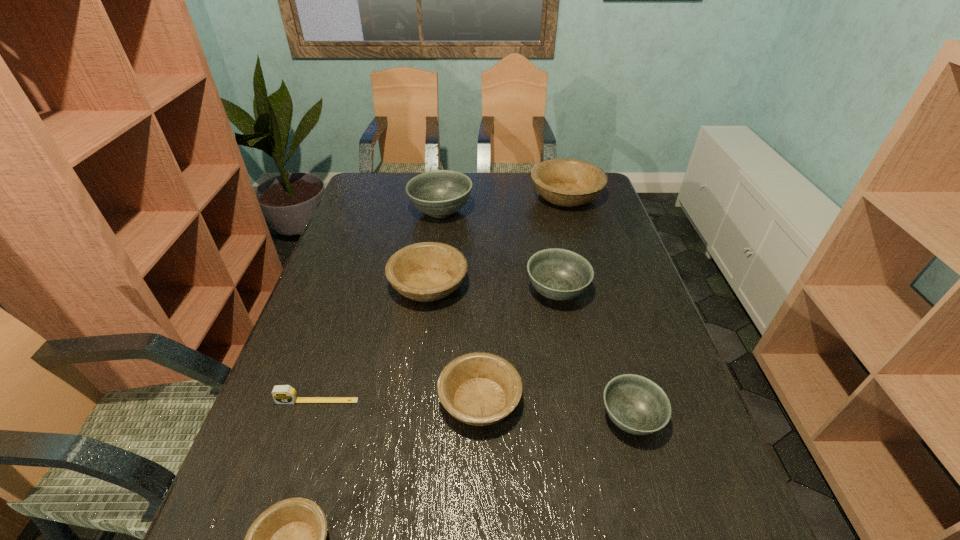
Find the location of a particular element. This screenshot has height=540, width=960. the fifth closest bowl to the tape measure is located at coordinates (637, 405).

You are a GUI agent. You are given a task and a screenshot of the screen. Output one action in this format:
    pyautogui.click(x=<x>, y=<y>)
    Task: Click on the bowl that is the closest to the nearest gray bowl
    The height and width of the screenshot is (540, 960).
    Given the screenshot: What is the action you would take?
    pyautogui.click(x=479, y=388)

Locate an element on the screen. gray bowl that is the third nearest to the second nearest beige bowl is located at coordinates (440, 193).

Identify the location of gray bowl identified as the second closest to the third biggest beige bowl. This screenshot has width=960, height=540. (559, 274).

Choose which beige bowl is the second nearest neighbor to the tape measure. Please provide its 2D coordinates. Your answer should be formatted as a tuple, i.e. [(x, y)], where the tuple contains the x and y coordinates of a point satisfying the conditions above.

[(288, 539)]

Select which beige bowl is the third closest to the farthest beige bowl. Please provide its 2D coordinates. Your answer should be formatted as a tuple, i.e. [(x, y)], where the tuple contains the x and y coordinates of a point satisfying the conditions above.

[(288, 539)]

Where is `vacant space that satisfies the following two spatial constraints: 1. on the back side of the second biggest beige bowl; 2. on the right side of the farthest beige bowl`? vacant space that satisfies the following two spatial constraints: 1. on the back side of the second biggest beige bowl; 2. on the right side of the farthest beige bowl is located at coordinates (441, 197).

Where is `vacant space that satisfies the following two spatial constraints: 1. on the front side of the third nearest beige bowl; 2. on the left side of the smallest gray bowl`? This screenshot has height=540, width=960. vacant space that satisfies the following two spatial constraints: 1. on the front side of the third nearest beige bowl; 2. on the left side of the smallest gray bowl is located at coordinates (411, 418).

I want to click on vacant point that satisfies the following two spatial constraints: 1. on the front side of the second farthest beige bowl; 2. on the left side of the third farthest beige bowl, so click(414, 401).